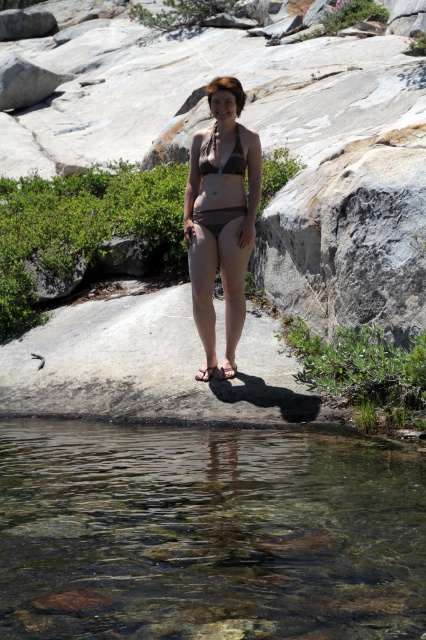
You are a photographer setting up for a shoot. You have two items to place in the scene described. The first is the brown matte bikini at center and the second is the matte brown bikini top at center. Based on their sizes, which item should you place first to ensure proper positioning?

The brown matte bikini at center should be placed first because it has a larger size compared to the matte brown bikini top at center, allowing for easier adjustment of positioning before placing the smaller item.

You are standing at the point closer to the camera between the two points, point (290, 138) and point (201, 326). Which point are you at?

You are at point (201, 326) because it is closer to the camera than point (290, 138).